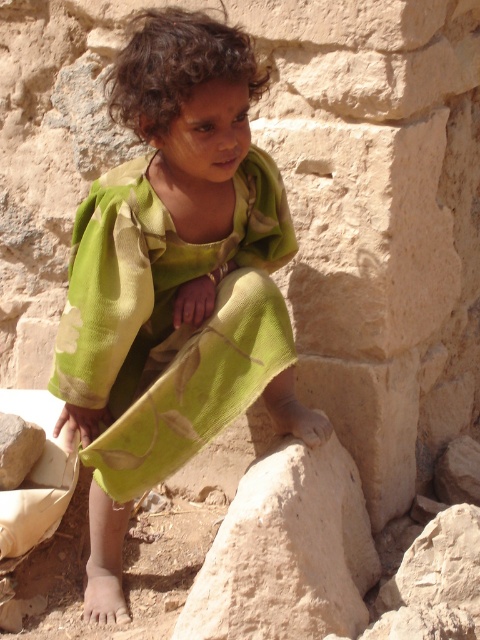
You are a photographer setting up a shoot in this scene. You need to place a small prop between the green fabric at center and the smooth beige rock at lower center. Based on their heights, which object should the prop be placed closer to?

The green fabric at center is much taller than the smooth beige rock at lower center, so the prop should be placed closer to the smooth beige rock at lower center to ensure visibility over both objects.

You are a photographer trying to capture the child in the scene. You want to ensure the green fabric at center and the smooth beige rock at lower center are both visible in the frame. Which object should you place closer to the left side of your camera viewfinder to include both?

The green fabric at center is positioned on the left side of smooth beige rock at lower center, so to include both in the frame, you should position the camera so that the green fabric at center is on the left side and the smooth beige rock at lower center is on the right side.

You are a photographer adjusting your camera settings to focus on two points in the image. One point is at coordinates point (287,220) and the other is at point (218,614). Which point should you focus on first to ensure the closer object is sharp?

Point (287,220) is further to the camera than point (218,614), so you should focus on point (287,220) first to ensure the closer object is sharp.